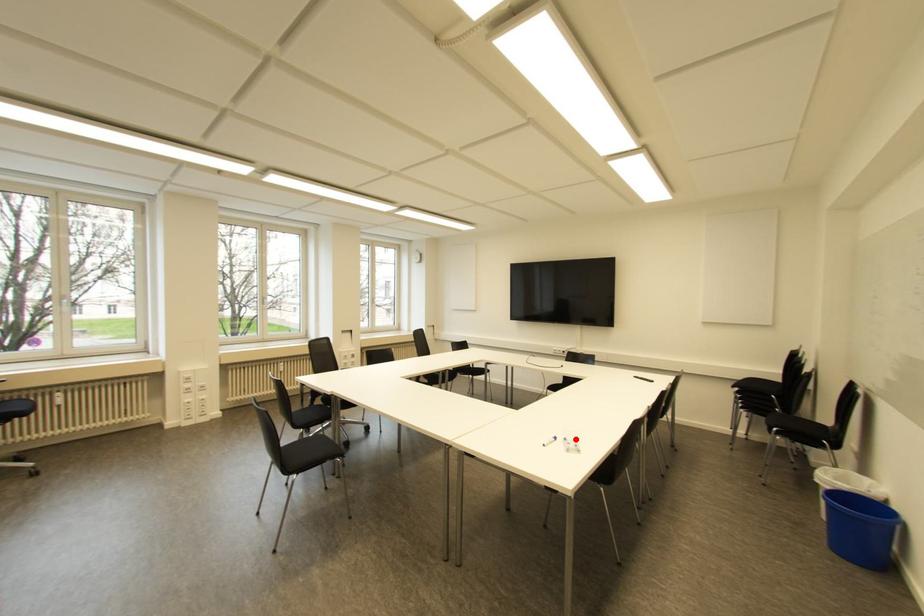
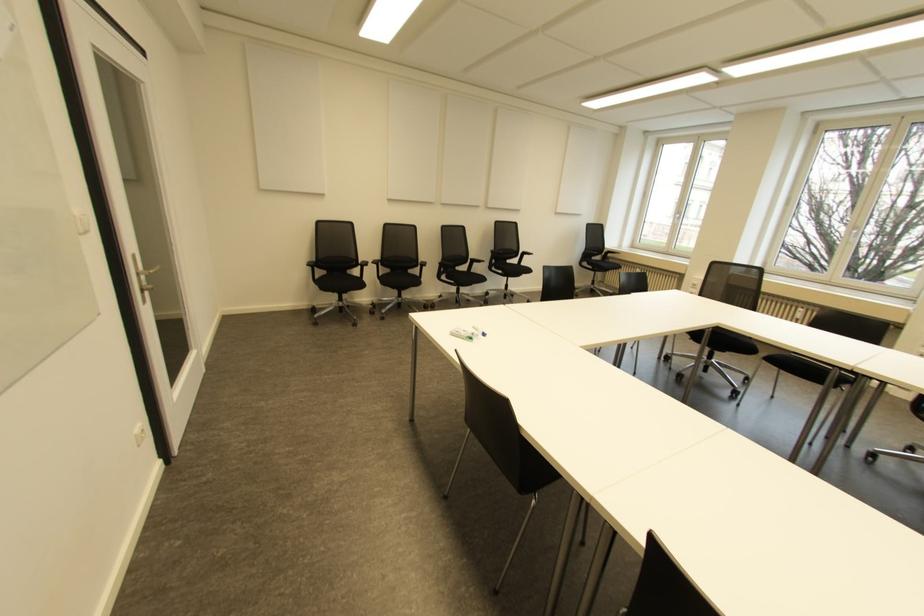
Find the pixel in the second image that matches the highlighted location in the first image.

(470, 338)